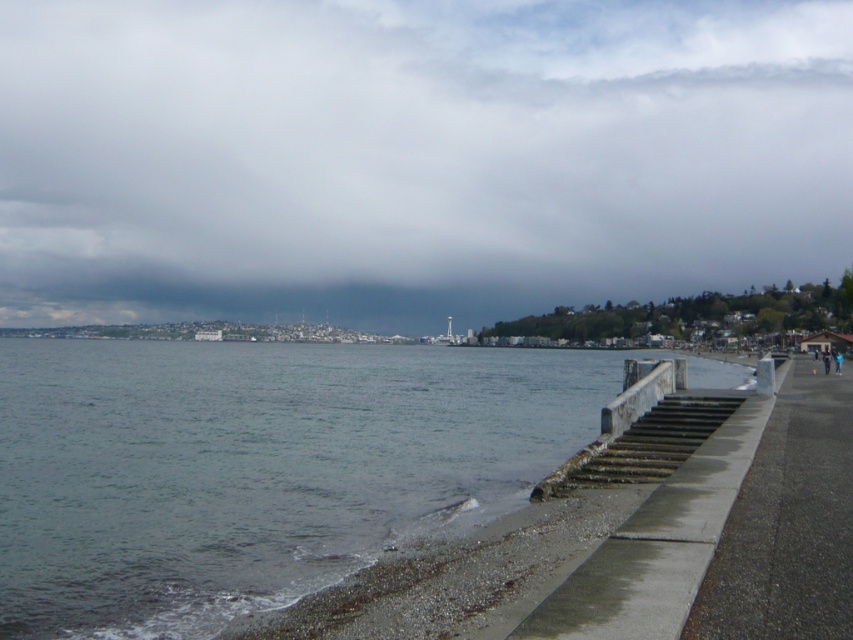
Does dark gray cloud at upper center appear over clear water at lower left?

Yes.

Who is more forward, (699,67) or (36,600)?

Positioned in front is point (36,600).

Does point (294, 33) come closer to viewer compared to point (122, 397)?

No, (294, 33) is behind (122, 397).

You are a GUI agent. You are given a task and a screenshot of the screen. Output one action in this format:
    pyautogui.click(x=<x>, y=<y>)
    Task: Click on the dark gray cloud at upper center
    The height and width of the screenshot is (640, 853).
    Given the screenshot: What is the action you would take?
    pyautogui.click(x=415, y=156)

Does point (494, 396) come farther from viewer compared to point (811, 454)?

Yes, it is.

Between clear water at lower left and gray concrete pavement at lower right, which one has less height?

gray concrete pavement at lower right

Find the location of a particular element. The width and height of the screenshot is (853, 640). clear water at lower left is located at coordinates (254, 467).

Between dark gray cloud at upper center and gray concrete pavement at lower right, which one has less height?

With less height is gray concrete pavement at lower right.

Can you confirm if dark gray cloud at upper center is taller than gray concrete pavement at lower right?

Yes.

Is point (747, 36) farther from camera compared to point (819, 513)?

Yes.

Find the location of a particular element. dark gray cloud at upper center is located at coordinates 415,156.